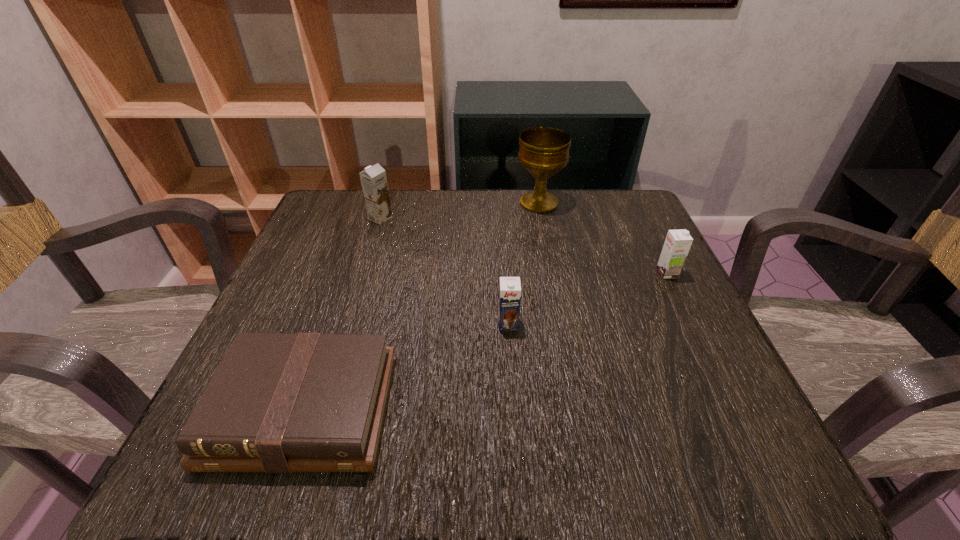
Where is `object that is at the far left corner`? Image resolution: width=960 pixels, height=540 pixels. object that is at the far left corner is located at coordinates (373, 179).

This screenshot has width=960, height=540. Find the location of `object present at the near left corner`. object present at the near left corner is located at coordinates (278, 402).

In the image, there is a desktop. Identify the location of free space at the far edge. (543, 224).

Find the location of a particular element. This screenshot has height=540, width=960. free space at the near edge of the desktop is located at coordinates (459, 457).

In the image, there is a desktop. Identify the location of free space at the left edge. The height and width of the screenshot is (540, 960). (320, 333).

You are a GUI agent. You are given a task and a screenshot of the screen. Output one action in this format:
    pyautogui.click(x=<x>, y=<y>)
    Task: Click on the vacant point at the right edge
    
    Given the screenshot: What is the action you would take?
    pyautogui.click(x=608, y=298)

In the image, there is a desktop. Where is `vacant region at the far left corner`? vacant region at the far left corner is located at coordinates (333, 239).

Where is `free space at the far right corner`? free space at the far right corner is located at coordinates (584, 194).

Image resolution: width=960 pixels, height=540 pixels. In the image, there is a desktop. Find the location of `vacant region at the near right corner`. vacant region at the near right corner is located at coordinates (646, 431).

Find the location of a particular element. Image resolution: width=960 pixels, height=540 pixels. vacant area between the fourth object from left to right and the Bible is located at coordinates (421, 307).